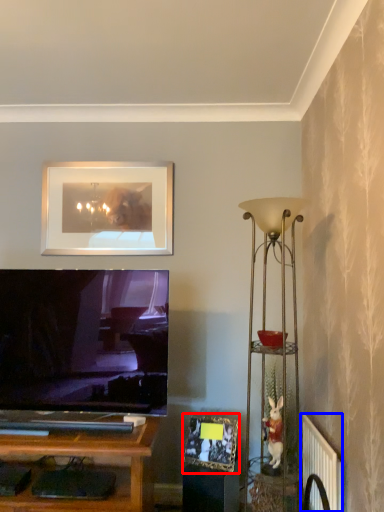
Question: Which object appears farthest to the camera in this image, picture frame (highlighted by a red box) or radiator (highlighted by a blue box)?

Choices:
 (A) picture frame
 (B) radiator

Answer: (A)